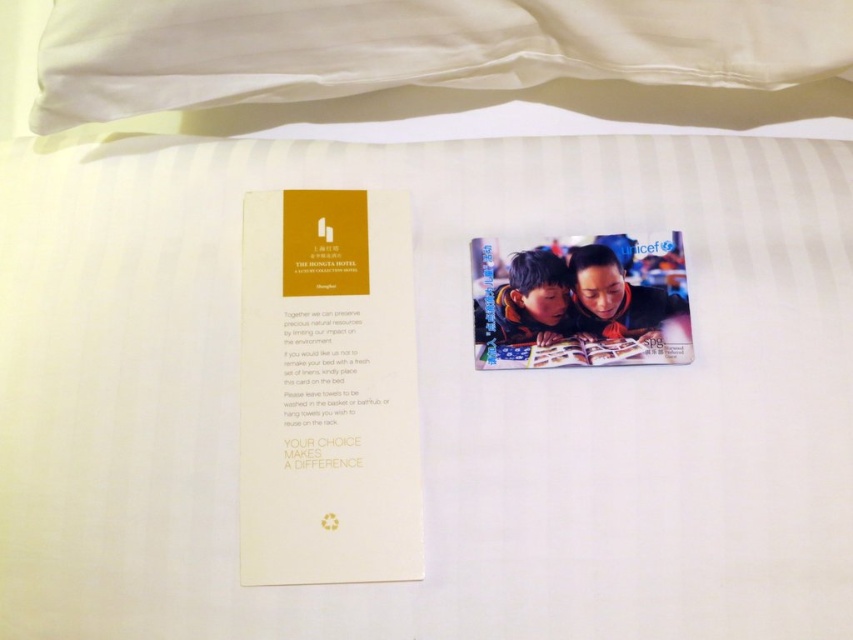
Which is more to the left, gold paper card at left or matte plastic magazine at center?

gold paper card at left is more to the left.

Can you confirm if gold paper card at left is positioned to the left of matte plastic magazine at center?

Correct, you'll find gold paper card at left to the left of matte plastic magazine at center.

Between point (273, 268) and point (664, 344), which one is positioned in front?

Positioned in front is point (664, 344).

The width and height of the screenshot is (853, 640). I want to click on gold paper card at left, so click(328, 390).

Does white soft pillow at upper center have a lesser width compared to matte plastic magazine at center?

Incorrect, white soft pillow at upper center's width is not less than matte plastic magazine at center's.

Is white soft pillow at upper center above matte plastic magazine at center?

Correct, white soft pillow at upper center is located above matte plastic magazine at center.

Is point (519, 60) positioned in front of point (643, 243)?

No, it is not.

At what (x,y) coordinates should I click in order to perform the action: click on white soft pillow at upper center. Please return your answer as a coordinate pair (x, y). This screenshot has height=640, width=853. Looking at the image, I should click on (440, 60).

Is white soft pillow at upper center taller than gold paper card at left?

No, white soft pillow at upper center is not taller than gold paper card at left.

What do you see at coordinates (440, 60) in the screenshot? The height and width of the screenshot is (640, 853). I see `white soft pillow at upper center` at bounding box center [440, 60].

Where is `white soft pillow at upper center`? white soft pillow at upper center is located at coordinates (440, 60).